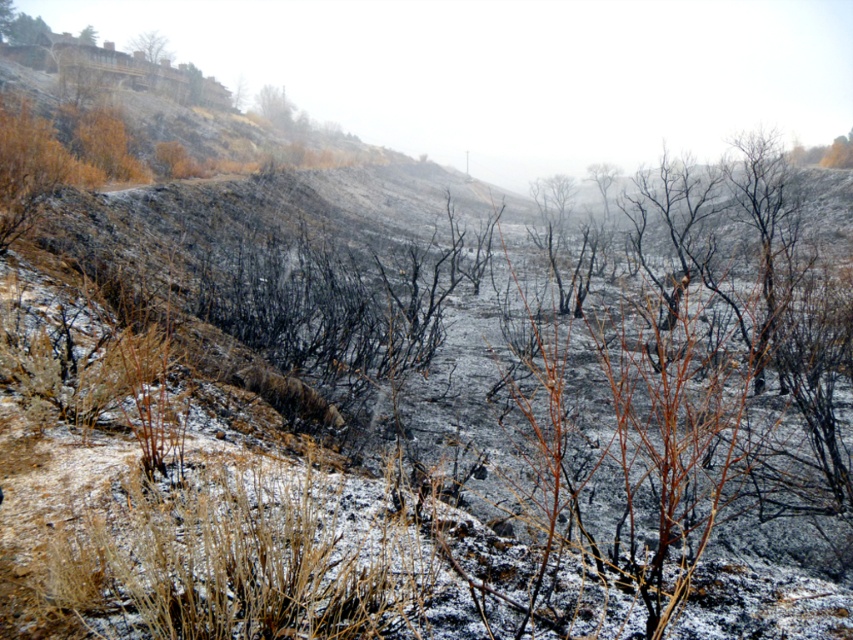
Question: Observing the image, what is the correct spatial positioning of brown dry branches at upper center in reference to brown wood tree at upper left?

Choices:
 (A) above
 (B) below

Answer: (B)

Question: Which of the following is the closest to the observer?

Choices:
 (A) (602, 196)
 (B) (723, 168)

Answer: (B)

Question: Does brown dry branches at center appear on the right side of brown wood tree at upper left?

Choices:
 (A) no
 (B) yes

Answer: (B)

Question: Which is nearer to the charred wood tree at center?

Choices:
 (A) brown wood tree at upper left
 (B) brown dry branches at upper center

Answer: (B)

Question: Which of the following is the farthest from the observer?

Choices:
 (A) brown wood tree at upper left
 (B) charred wood tree at center
 (C) brown dry branches at center

Answer: (C)

Question: Is brown dry branches at upper center smaller than brown dry branches at center?

Choices:
 (A) yes
 (B) no

Answer: (A)